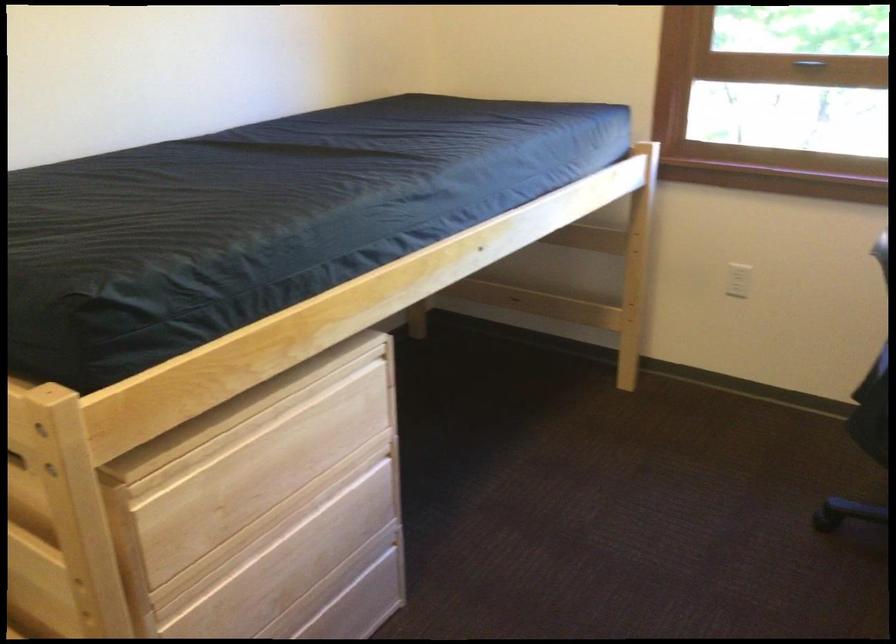
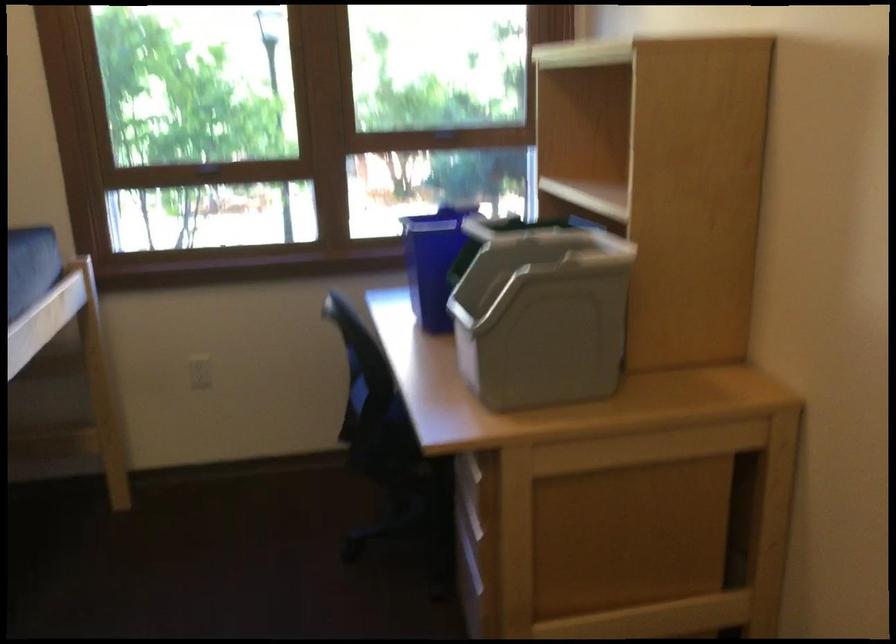
Question: The images are taken continuously from a first-person perspective. In which direction is your viewpoint rotating?

Choices:
 (A) Left
 (B) Right
 (C) Up
 (D) Down

Answer: (B)